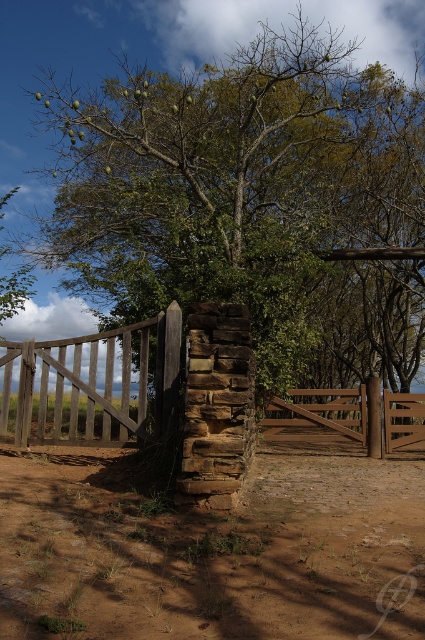
Is green leafy tree at center taller than brown dirt field at center?

Indeed, green leafy tree at center has a greater height compared to brown dirt field at center.

Between green leafy tree at center and brown dirt field at center, which one has more height?

With more height is green leafy tree at center.

Does point (323, 97) lie in front of point (408, 516)?

No.

Locate an element on the screen. The height and width of the screenshot is (640, 425). green leafy tree at center is located at coordinates (252, 202).

Is green leafy tree at center positioned behind brown wooden gate at center?

Yes, green leafy tree at center is further from the viewer.

Consider the image. Can you confirm if green leafy tree at center is shorter than brown wooden gate at center?

Incorrect, green leafy tree at center's height does not fall short of brown wooden gate at center's.

Is point (266, 88) more distant than point (221, 460)?

Yes, point (266, 88) is farther from viewer.

At what (x,y) coordinates should I click in order to perform the action: click on green leafy tree at center. Please return your answer as a coordinate pair (x, y). The width and height of the screenshot is (425, 640). Looking at the image, I should click on (252, 202).

Who is more forward, (217, 627) or (173, 342)?

Positioned in front is point (217, 627).

Between brown dirt field at center and brown wooden gate at center, which one is positioned higher?

Positioned higher is brown wooden gate at center.

What are the coordinates of `brown dirt field at center` in the screenshot? It's located at (212, 552).

This screenshot has width=425, height=640. Find the location of `brown dirt field at center`. brown dirt field at center is located at coordinates (212, 552).